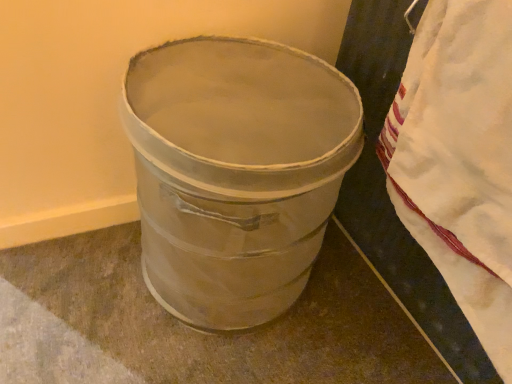
Question: Can you confirm if metallic silver trash can at center is positioned to the left of white cotton blanket at right?

Choices:
 (A) yes
 (B) no

Answer: (A)

Question: From the image's perspective, would you say metallic silver trash can at center is positioned over white cotton blanket at right?

Choices:
 (A) yes
 (B) no

Answer: (B)

Question: Does metallic silver trash can at center turn towards white cotton blanket at right?

Choices:
 (A) no
 (B) yes

Answer: (B)

Question: Is white cotton blanket at right located within metallic silver trash can at center?

Choices:
 (A) yes
 (B) no

Answer: (B)

Question: Is metallic silver trash can at center not within white cotton blanket at right?

Choices:
 (A) no
 (B) yes

Answer: (B)

Question: Is metallic silver trash can at center wider than white cotton blanket at right?

Choices:
 (A) no
 (B) yes

Answer: (B)

Question: Does white cotton blanket at right turn towards metallic silver trash can at center?

Choices:
 (A) yes
 (B) no

Answer: (B)

Question: Is white cotton blanket at right outside of metallic silver trash can at center?

Choices:
 (A) yes
 (B) no

Answer: (A)

Question: Is white cotton blanket at right to the left of metallic silver trash can at center from the viewer's perspective?

Choices:
 (A) yes
 (B) no

Answer: (B)

Question: Would you say white cotton blanket at right contains metallic silver trash can at center?

Choices:
 (A) yes
 (B) no

Answer: (B)

Question: Is white cotton blanket at right taller than metallic silver trash can at center?

Choices:
 (A) yes
 (B) no

Answer: (B)

Question: From the image's perspective, is white cotton blanket at right under metallic silver trash can at center?

Choices:
 (A) yes
 (B) no

Answer: (B)

Question: From the image's perspective, relative to white cotton blanket at right, is metallic silver trash can at center above or below?

Choices:
 (A) below
 (B) above

Answer: (A)